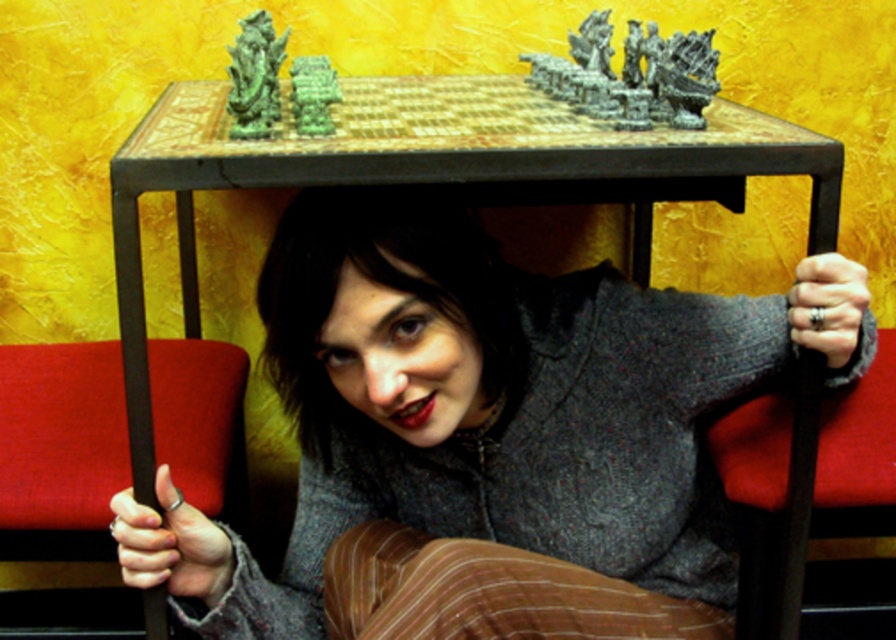
You are trying to reach the rustic wooden table at center from the dark wood chair at lower right. Which direction should you move to get there?

The rustic wooden table at center is positioned on the left side of the dark wood chair at lower right, so you should move to your left to reach it.

You are standing in a room with a rustic wooden table at center. You want to place a new decorative item exactly at the point marked by the coordinates point (432,172). What object is located at that point?

The point (432,172) marks the rustic wooden table at center, so placing the decorative item there would place it directly on the rustic wooden table at center.

You are standing in front of the table with the scattered greenish gray figurines. You want to place a new figurine exactly at the location marked by the point [59,449]. Is this point on the table or on the brown leather chair at lower left?

The point [59,449] corresponds to the brown leather chair at lower left, so placing the figurine there would put it on the chair, not the table.